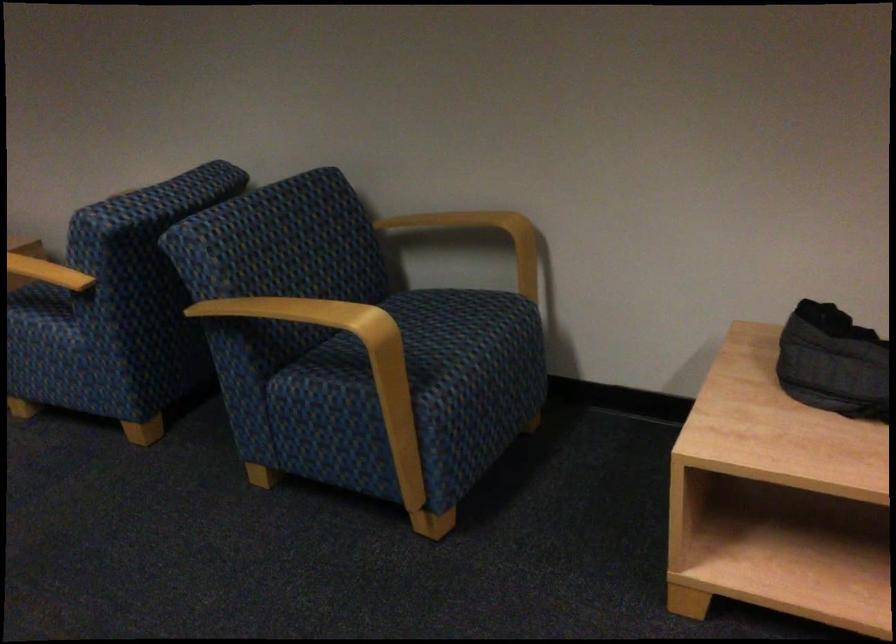
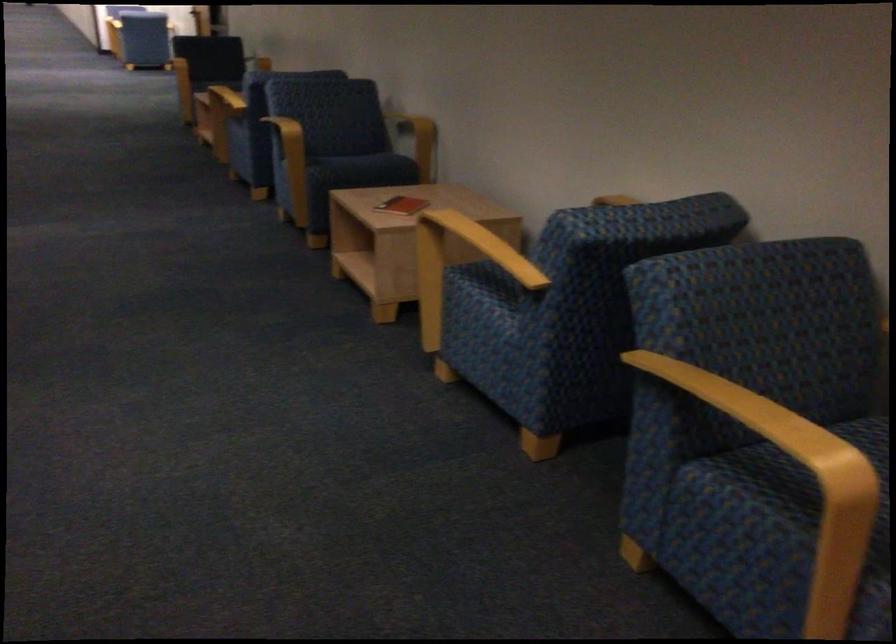
Find the pixel in the second image that matches pixel 332 327 in the first image.

(787, 446)